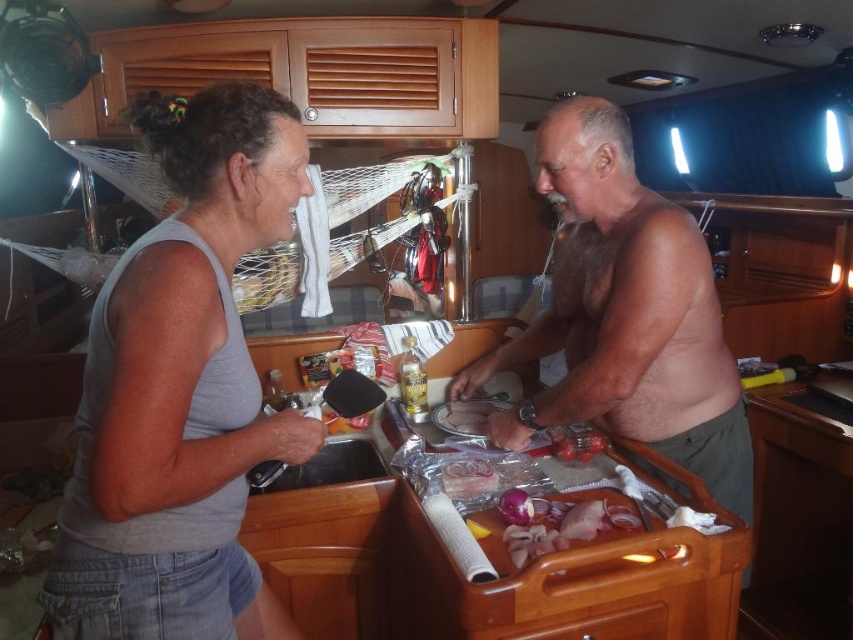
You are a chef in a small kitchen and need to reach for the shiny silver knife at center and the black plastic sink at lower left. Which object is located higher up in the image?

The shiny silver knife at center is above the black plastic sink at lower left, so it is higher up in the image.

You are a photographer standing in the kitchen scene. You need to take a photo that includes both the gray fabric tank top at upper left and the translucent plastic bag at center. Which object will appear larger in the photo?

The gray fabric tank top at upper left will appear larger in the photo because it is closer to the viewer than the translucent plastic bag at center.